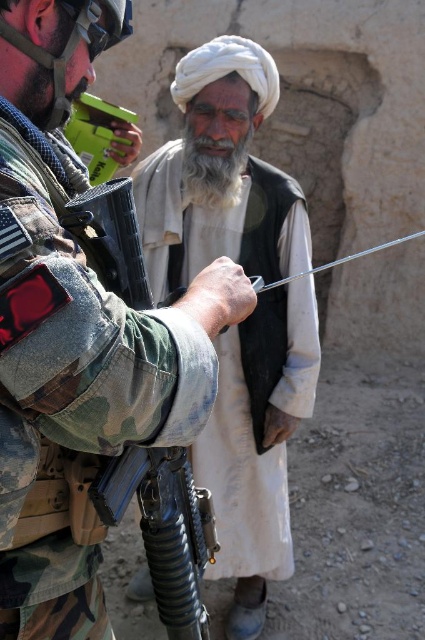
Question: Can you confirm if white cotton turban at upper center is positioned to the right of white soft beard at center?

Choices:
 (A) yes
 (B) no

Answer: (A)

Question: Which point is farther from the camera taking this photo?

Choices:
 (A) (252, 256)
 (B) (200, 346)

Answer: (A)

Question: Is white cotton turban at upper center positioned at the back of white soft beard at center?

Choices:
 (A) yes
 (B) no

Answer: (B)

Question: Among these objects, which one is nearest to the camera?

Choices:
 (A) camouflage fabric uniform at left
 (B) white soft beard at center

Answer: (A)

Question: Is white cotton turban at upper center in front of white soft beard at center?

Choices:
 (A) yes
 (B) no

Answer: (A)

Question: Which object appears closest to the camera in this image?

Choices:
 (A) white cotton turban at upper center
 (B) white soft beard at center
 (C) camouflage fabric uniform at left

Answer: (C)